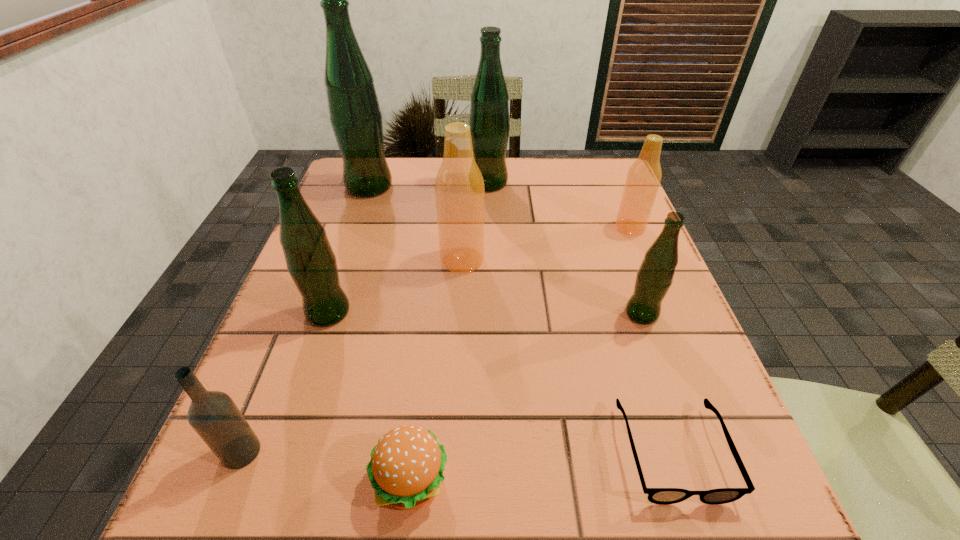
I want to click on blank area at the left edge, so click(x=329, y=368).

Find the location of a particular element. This screenshot has height=540, width=960. free space at the right edge is located at coordinates (617, 262).

The height and width of the screenshot is (540, 960). In order to click on blank space at the far right corner of the desktop in this screenshot , I will do `click(589, 178)`.

Where is `empty location between the third smallest green beer bottle and the hamburger`? The width and height of the screenshot is (960, 540). empty location between the third smallest green beer bottle and the hamburger is located at coordinates (449, 333).

Image resolution: width=960 pixels, height=540 pixels. Identify the location of vacant region between the eighth tallest object and the sixth nearest object. (437, 371).

Where is `vacant point located between the second smallest green beer bottle and the hamburger`? This screenshot has width=960, height=540. vacant point located between the second smallest green beer bottle and the hamburger is located at coordinates (370, 397).

Locate an element on the screen. This screenshot has width=960, height=540. free space that is in between the third biggest green beer bottle and the black spectacles is located at coordinates (500, 382).

This screenshot has height=540, width=960. I want to click on free space that is in between the third biggest green beer bottle and the hamburger, so click(370, 397).

The height and width of the screenshot is (540, 960). I want to click on free space between the third farthest beer bottle and the vodka, so click(436, 340).

This screenshot has width=960, height=540. Find the location of `unoccupied position between the smaller tan beer bottle and the black vodka`. unoccupied position between the smaller tan beer bottle and the black vodka is located at coordinates (436, 340).